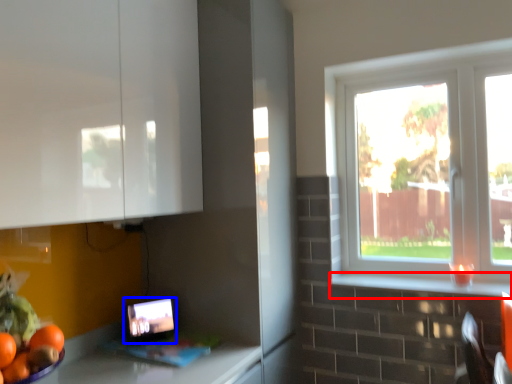
Question: Which object appears closest to the camera in this image, window sill (highlighted by a red box) or tablet computer (highlighted by a blue box)?

Choices:
 (A) window sill
 (B) tablet computer

Answer: (A)